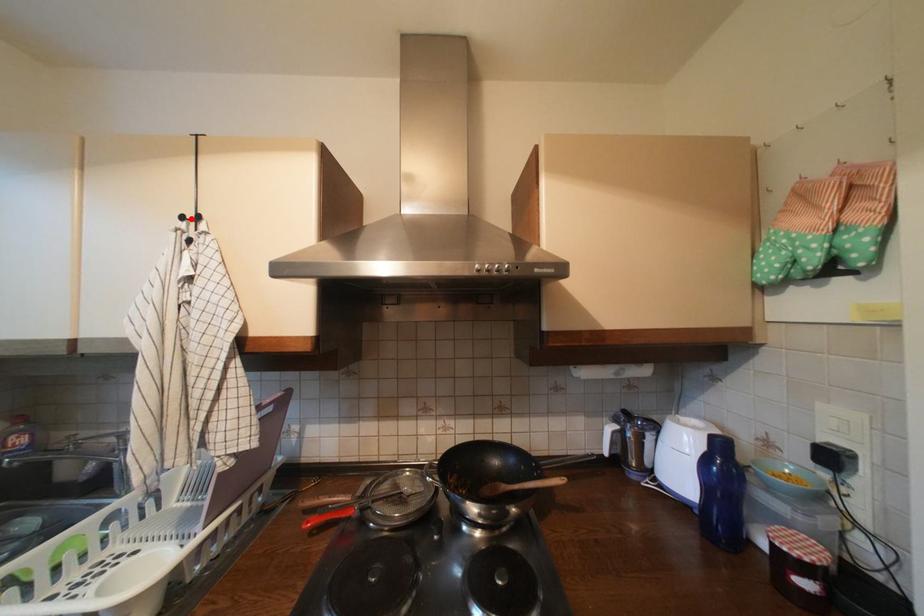
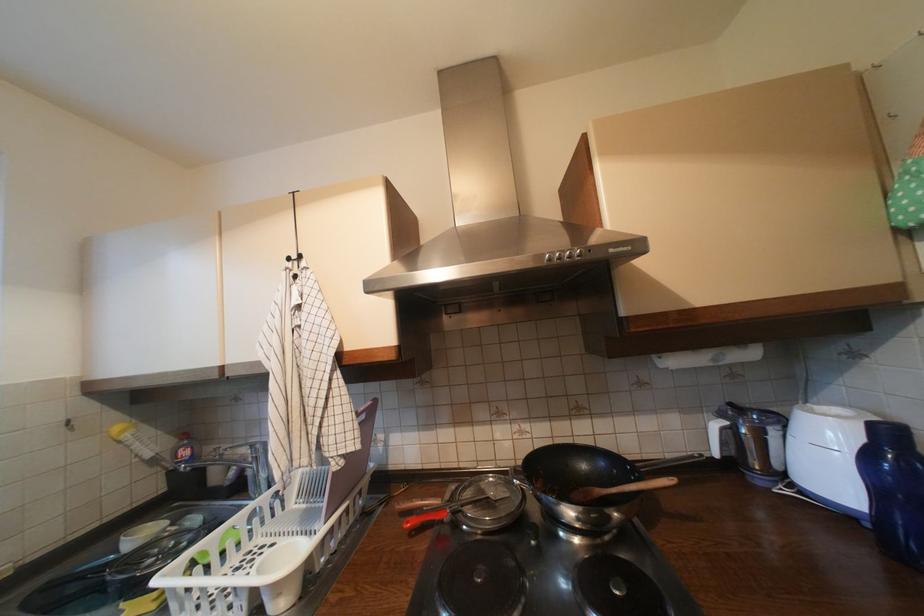
The point at the highlighted location is marked in the first image. Where is the corresponding point in the second image?

(297, 260)